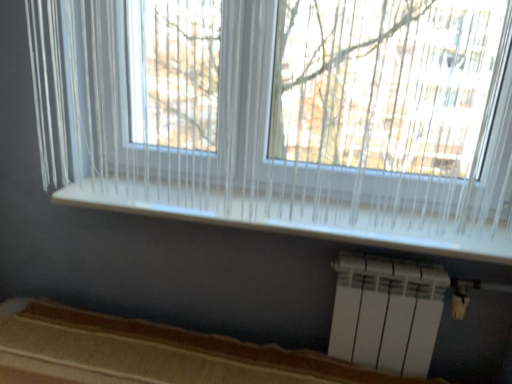
Question: Considering the relative sizes of white translucent curtain at upper center and brown fabric bed frame at lower center in the image provided, is white translucent curtain at upper center wider than brown fabric bed frame at lower center?

Choices:
 (A) yes
 (B) no

Answer: (B)

Question: Is white translucent curtain at upper center taller than brown fabric bed frame at lower center?

Choices:
 (A) no
 (B) yes

Answer: (B)

Question: From the image's perspective, is white translucent curtain at upper center on top of brown fabric bed frame at lower center?

Choices:
 (A) no
 (B) yes

Answer: (B)

Question: Does white translucent curtain at upper center have a smaller size compared to brown fabric bed frame at lower center?

Choices:
 (A) no
 (B) yes

Answer: (B)

Question: Is white translucent curtain at upper center facing towards brown fabric bed frame at lower center?

Choices:
 (A) no
 (B) yes

Answer: (A)

Question: Do you think white plastic radiator at lower right is within white translucent curtain at upper center, or outside of it?

Choices:
 (A) outside
 (B) inside

Answer: (A)

Question: In the image, is white plastic radiator at lower right on the left side or the right side of white translucent curtain at upper center?

Choices:
 (A) left
 (B) right

Answer: (B)

Question: In terms of height, does white plastic radiator at lower right look taller or shorter compared to white translucent curtain at upper center?

Choices:
 (A) tall
 (B) short

Answer: (B)

Question: From a real-world perspective, is white plastic radiator at lower right physically located above or below white translucent curtain at upper center?

Choices:
 (A) below
 (B) above

Answer: (A)

Question: Relative to white wood window sill at center, is white translucent curtain at upper center in front or behind?

Choices:
 (A) front
 (B) behind

Answer: (A)

Question: Does point (462, 119) appear closer or farther from the camera than point (241, 188)?

Choices:
 (A) closer
 (B) farther

Answer: (A)

Question: Is white translucent curtain at upper center wider or thinner than white wood window sill at center?

Choices:
 (A) thin
 (B) wide

Answer: (A)

Question: Is white translucent curtain at upper center situated inside white wood window sill at center or outside?

Choices:
 (A) outside
 (B) inside

Answer: (A)

Question: In the image, is white plastic radiator at lower right on the left side or the right side of white wood window sill at center?

Choices:
 (A) left
 (B) right

Answer: (B)

Question: In terms of height, does white plastic radiator at lower right look taller or shorter compared to white wood window sill at center?

Choices:
 (A) tall
 (B) short

Answer: (A)